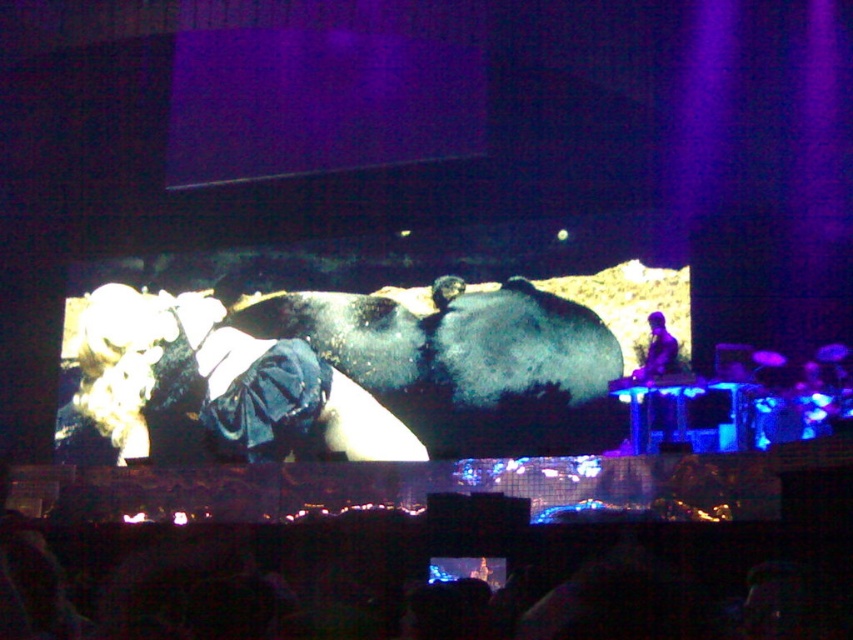
Question: Among these points, which one is nearest to the camera?

Choices:
 (A) (671, 360)
 (B) (270, 401)

Answer: (A)

Question: Does shiny blue jacket at center have a smaller size compared to dark blue fabric at right?

Choices:
 (A) no
 (B) yes

Answer: (A)

Question: Which point appears farthest from the camera in this image?

Choices:
 (A) click(x=386, y=445)
 (B) click(x=650, y=358)

Answer: (A)

Question: Among these objects, which one is nearest to the camera?

Choices:
 (A) shiny blue jacket at center
 (B) dark blue fabric at right

Answer: (B)

Question: Is shiny blue jacket at center positioned behind dark blue fabric at right?

Choices:
 (A) yes
 (B) no

Answer: (A)

Question: Does shiny blue jacket at center appear over dark blue fabric at right?

Choices:
 (A) yes
 (B) no

Answer: (B)